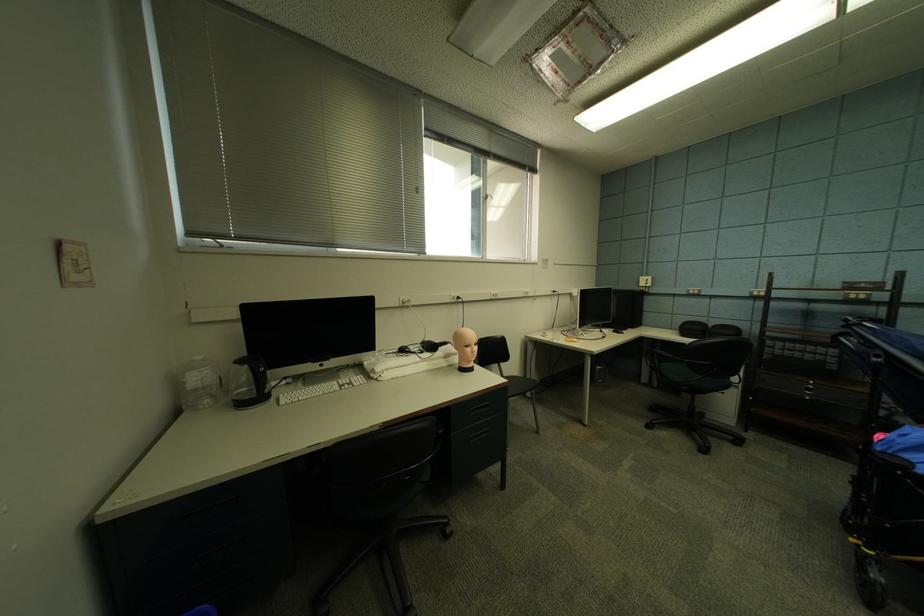
Locate an element on the screen. This screenshot has width=924, height=616. light switch is located at coordinates (645, 281).